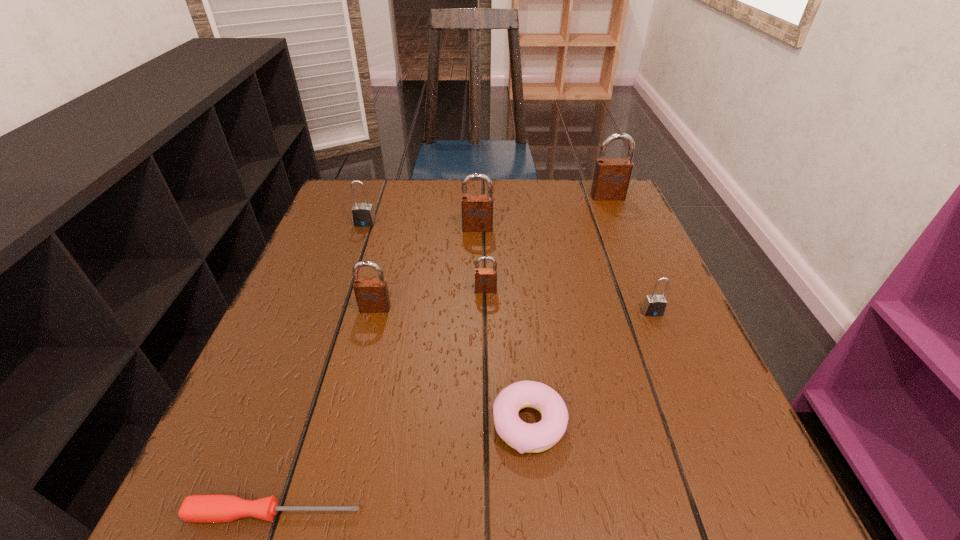
Locate an element on the screen. This screenshot has height=540, width=960. the biggest brown padlock is located at coordinates (611, 178).

This screenshot has height=540, width=960. What are the coordinates of `the farthest brown padlock` in the screenshot? It's located at (611, 178).

Identify the location of the seventh shortest object. This screenshot has height=540, width=960. (477, 209).

This screenshot has width=960, height=540. What are the coordinates of `the second biggest brown padlock` in the screenshot? It's located at (477, 209).

Find the location of a particular element. the left gray padlock is located at coordinates (363, 215).

This screenshot has height=540, width=960. Identify the location of the leftmost padlock. (363, 215).

This screenshot has width=960, height=540. Identify the location of the nearest brown padlock. (372, 296).

Image resolution: width=960 pixels, height=540 pixels. What are the coordinates of `the second smallest brown padlock` in the screenshot? It's located at (372, 296).

The width and height of the screenshot is (960, 540). Identify the location of the nearer gray padlock. pos(654,305).

Locate an element on the screen. The width and height of the screenshot is (960, 540). the right gray padlock is located at coordinates (654, 305).